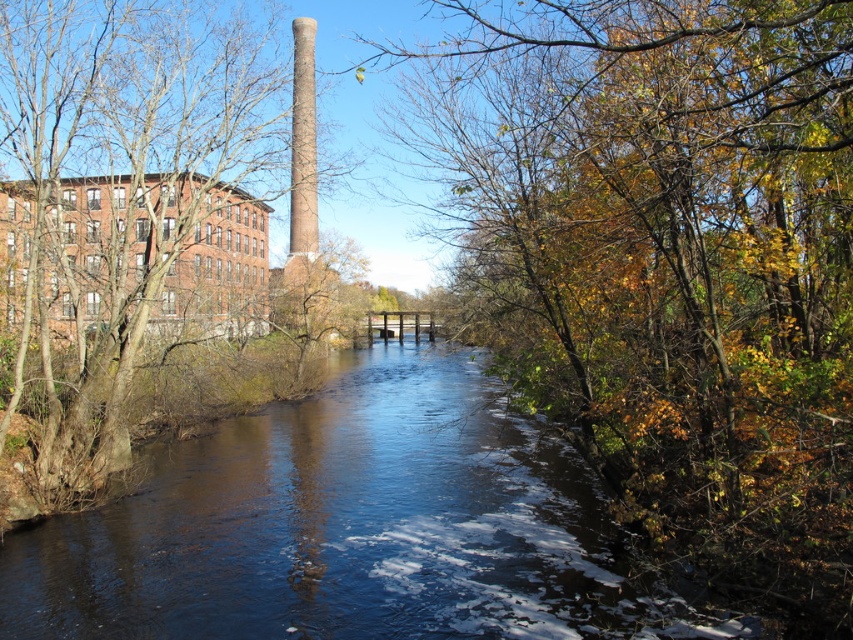
You are standing at the riverside and see autumn leaves at center. If you want to pick them up, in which direction should you walk relative to the river?

The autumn leaves at center are located at coordinates point [668,266], so you should walk towards the center of the river to reach them.

You are standing on the riverside path and want to pick up the autumn leaves at center and the smooth bark tree at left. Which object is closer to your right hand if you extend it naturally?

The autumn leaves at center is positioned on the right side of smooth bark tree at left, so it would be closer to your right hand.